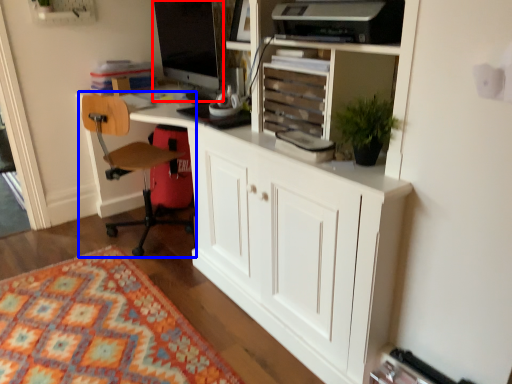
Question: Which object is closer to the camera taking this photo, computer monitor (highlighted by a red box) or chair (highlighted by a blue box)?

Choices:
 (A) computer monitor
 (B) chair

Answer: (B)